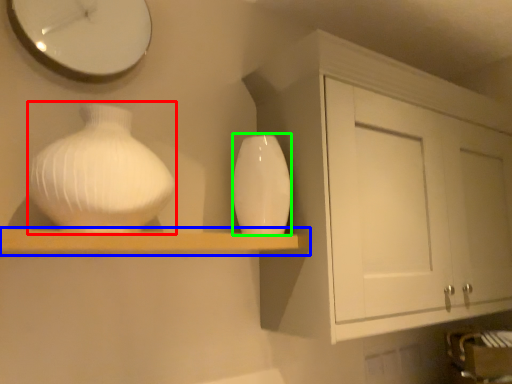
Question: Which object is positioned closest to vase (highlighted by a red box)? Select from shelf (highlighted by a blue box) and vase (highlighted by a green box).

Choices:
 (A) shelf
 (B) vase

Answer: (A)